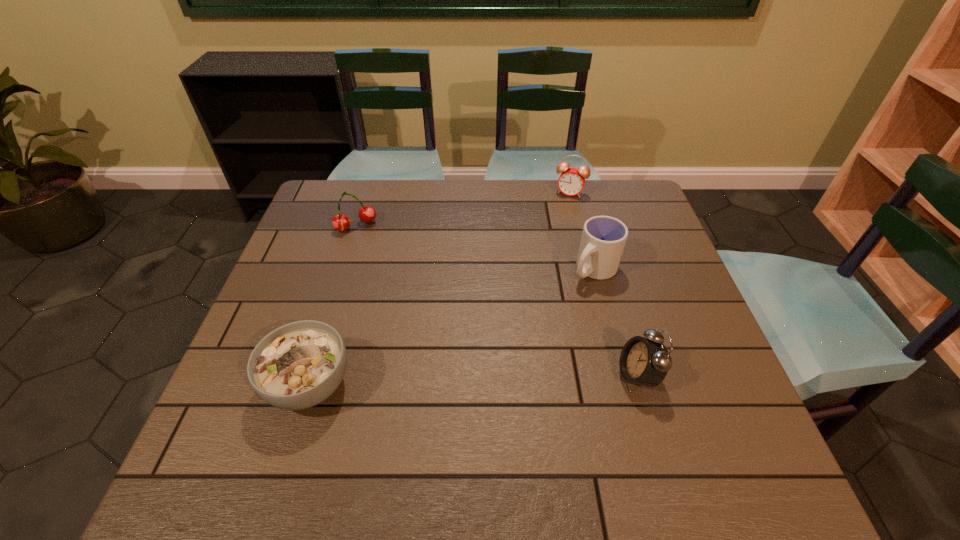
You are a GUI agent. You are given a task and a screenshot of the screen. Output one action in this format:
    pyautogui.click(x=<x>, y=<y>)
    Task: Click on the soup bowl that is at the near edge
    This screenshot has width=960, height=540.
    Given the screenshot: What is the action you would take?
    pyautogui.click(x=298, y=365)

Where is `alarm clock that is at the near edge`? alarm clock that is at the near edge is located at coordinates (643, 361).

At what (x,y) coordinates should I click in order to perform the action: click on soup bowl located in the left edge section of the desktop. Please return your answer as a coordinate pair (x, y). The image size is (960, 540). Looking at the image, I should click on (298, 365).

Identify the location of cherry situated at the left edge. (340, 222).

At what (x,y) coordinates should I click in order to perform the action: click on alarm clock located at the right edge. Please return your answer as a coordinate pair (x, y). This screenshot has height=540, width=960. Looking at the image, I should click on (643, 361).

You are a GUI agent. You are given a task and a screenshot of the screen. Output one action in this format:
    pyautogui.click(x=<x>, y=<y>)
    Task: Click on the cup that is at the right edge
    This screenshot has height=540, width=960.
    Given the screenshot: What is the action you would take?
    pyautogui.click(x=603, y=239)

Locate an element on the screen. object located in the far left corner section of the desktop is located at coordinates (340, 222).

Identify the location of object that is at the near left corner. (298, 365).

Locate an element on the screen. Image resolution: width=960 pixels, height=540 pixels. object that is positioned at the near right corner is located at coordinates (643, 361).

Identify the location of vacant space at the far edge. This screenshot has height=540, width=960. (435, 219).